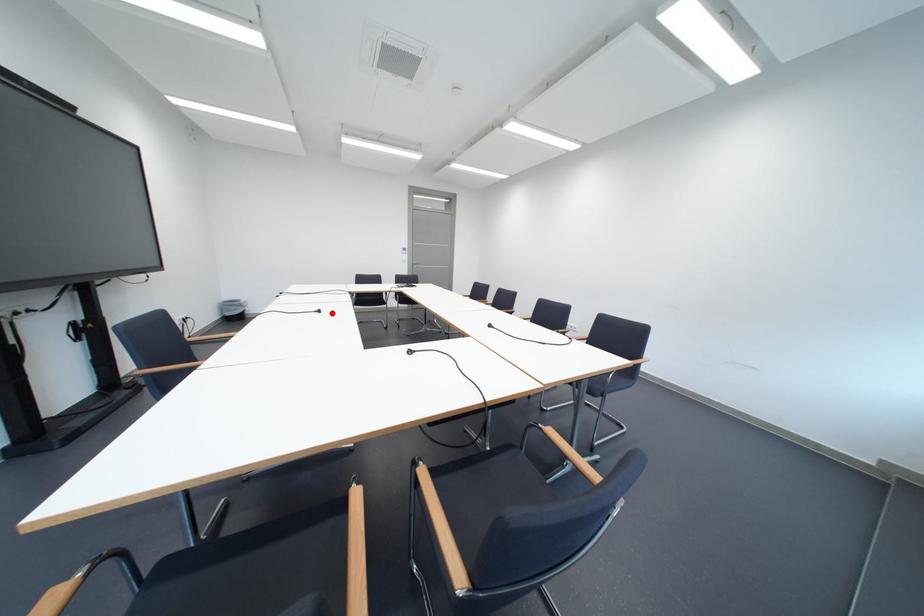
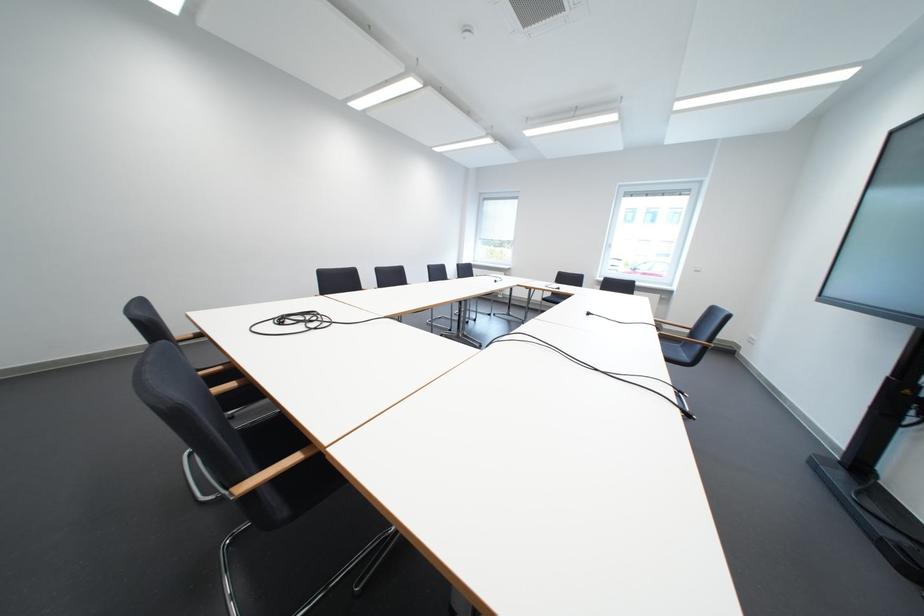
In the second image, find the point that corresponds to the highlighted location in the first image.

(601, 315)